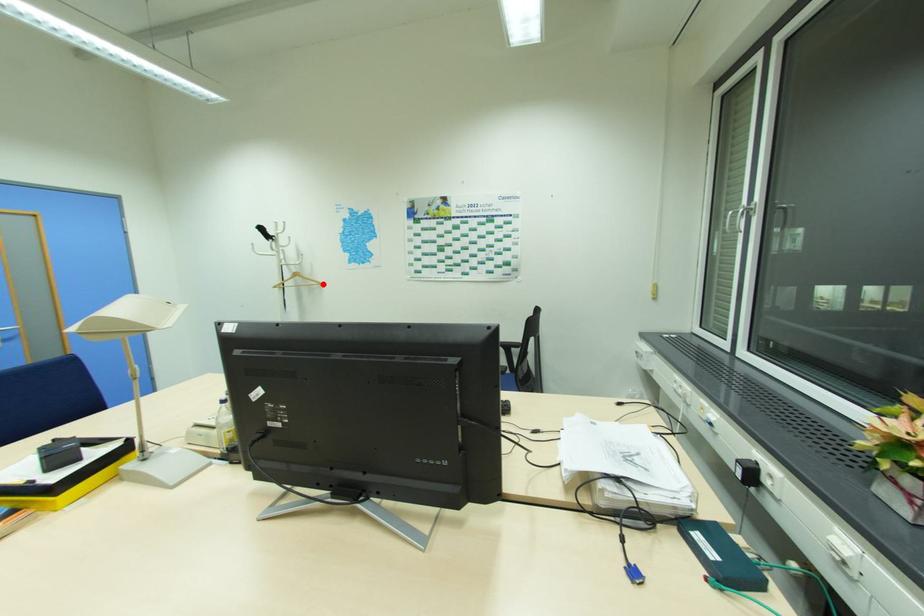
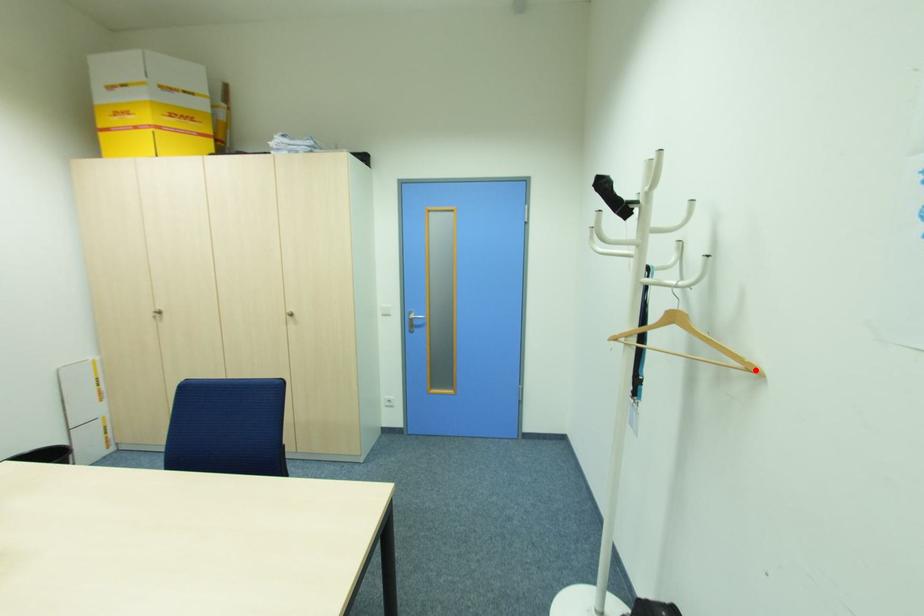
I am providing you with two images of the same scene from different viewpoints. A red point is marked on the first image and another point is marked on the second image. Is the marked point in image1 the same physical position as the marked point in image2?

Yes